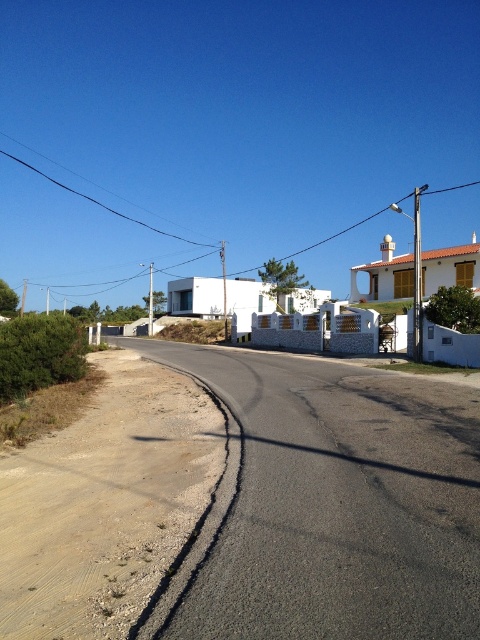
You are a driver approaching the road and need to know the height differences between the asphalt road at lower left and the asphalt road at center. Which one is taller?

The asphalt road at lower left is taller than the asphalt road at center.

You are standing on the rural road and want to reach the point marked as point (314, 392). If your walking speed is 3 feet per second, how long will it take you to reach that point?

The point (314, 392) is 51.58 feet away from the viewer. At a walking speed of 3 feet per second, it will take approximately 17.19 seconds to reach the point.

You are a driver approaching the road in the image. You need to choose between taking the asphalt road at lower left or the asphalt road at center. Which path is wider and safer for a large truck?

The asphalt road at lower left is bigger than the asphalt road at center, so it is wider and safer for a large truck.